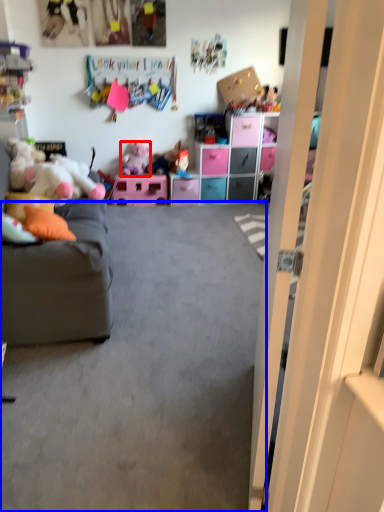
Question: Which point is further to the camera, toy (highlighted by a red box) or plain (highlighted by a blue box)?

Choices:
 (A) toy
 (B) plain

Answer: (A)